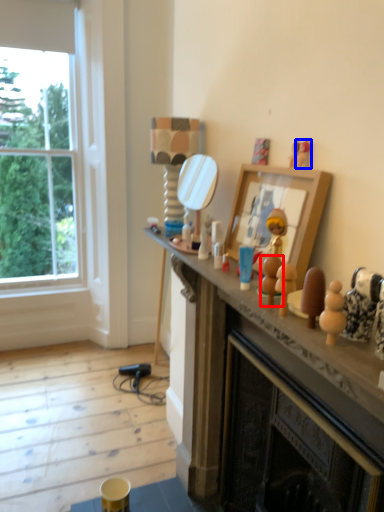
Question: Which point is further to the camera, toy (highlighted by a red box) or toy (highlighted by a blue box)?

Choices:
 (A) toy
 (B) toy

Answer: (B)